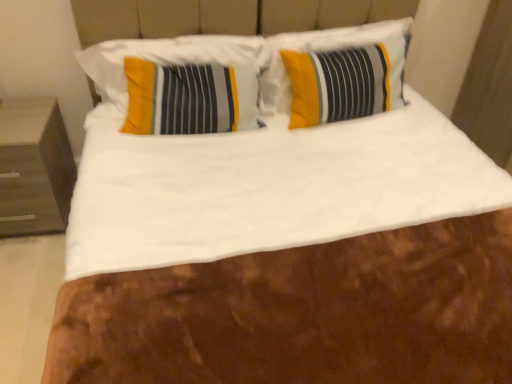
Question: From the image's perspective, is dark wood nightstand at left on yellow fabric pillow at center, positioned as the 1th pillow in right-to-left order?

Choices:
 (A) yes
 (B) no

Answer: (B)

Question: Is dark wood nightstand at left not inside yellow fabric pillow at center, positioned as the 1th pillow in right-to-left order?

Choices:
 (A) yes
 (B) no

Answer: (A)

Question: Is there a large distance between dark wood nightstand at left and yellow fabric pillow at center, positioned as the 1th pillow in right-to-left order?

Choices:
 (A) yes
 (B) no

Answer: (A)

Question: Does dark wood nightstand at left appear on the right side of yellow fabric pillow at center, positioned as the 1th pillow in right-to-left order?

Choices:
 (A) no
 (B) yes

Answer: (A)

Question: Is dark wood nightstand at left aimed at yellow fabric pillow at center, marked as the second pillow in a left-to-right arrangement?

Choices:
 (A) yes
 (B) no

Answer: (B)

Question: Would you say yellow striped pillow at upper left, the first pillow positioned from the left, is inside or outside yellow fabric pillow at center, marked as the second pillow in a left-to-right arrangement?

Choices:
 (A) inside
 (B) outside

Answer: (B)

Question: From their relative heights in the image, would you say yellow striped pillow at upper left, the 2th pillow positioned from the right, is taller or shorter than yellow fabric pillow at center, positioned as the 1th pillow in right-to-left order?

Choices:
 (A) short
 (B) tall

Answer: (A)

Question: From a real-world perspective, is yellow striped pillow at upper left, the first pillow positioned from the left, positioned above or below yellow fabric pillow at center, marked as the second pillow in a left-to-right arrangement?

Choices:
 (A) above
 (B) below

Answer: (A)

Question: From the image's perspective, is yellow striped pillow at upper left, the 2th pillow positioned from the right, above or below yellow fabric pillow at center, marked as the second pillow in a left-to-right arrangement?

Choices:
 (A) above
 (B) below

Answer: (B)

Question: From the image's perspective, is yellow fabric pillow at center, marked as the second pillow in a left-to-right arrangement, located above or below yellow striped pillow at upper left, the first pillow positioned from the left?

Choices:
 (A) above
 (B) below

Answer: (A)

Question: Is yellow fabric pillow at center, marked as the second pillow in a left-to-right arrangement, taller or shorter than yellow striped pillow at upper left, the 2th pillow positioned from the right?

Choices:
 (A) tall
 (B) short

Answer: (A)

Question: In terms of width, does yellow fabric pillow at center, marked as the second pillow in a left-to-right arrangement, look wider or thinner when compared to yellow striped pillow at upper left, the first pillow positioned from the left?

Choices:
 (A) thin
 (B) wide

Answer: (B)

Question: Relative to yellow striped pillow at upper left, the first pillow positioned from the left, is yellow fabric pillow at center, positioned as the 1th pillow in right-to-left order, in front or behind?

Choices:
 (A) front
 (B) behind

Answer: (B)

Question: From a real-world perspective, is yellow fabric pillow at center, marked as the second pillow in a left-to-right arrangement, physically located above or below dark wood nightstand at left?

Choices:
 (A) above
 (B) below

Answer: (A)

Question: Is yellow fabric pillow at center, positioned as the 1th pillow in right-to-left order, inside or outside of dark wood nightstand at left?

Choices:
 (A) outside
 (B) inside

Answer: (A)